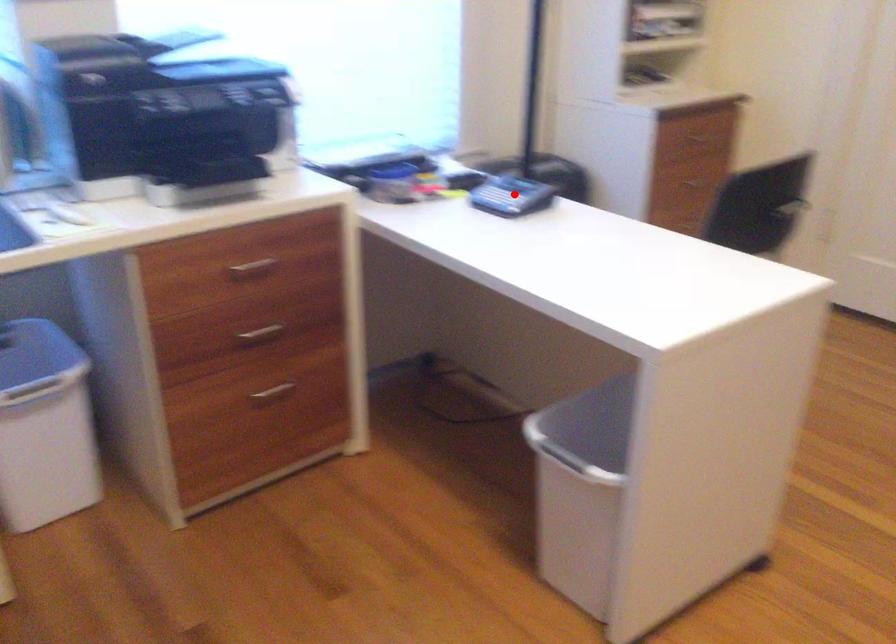
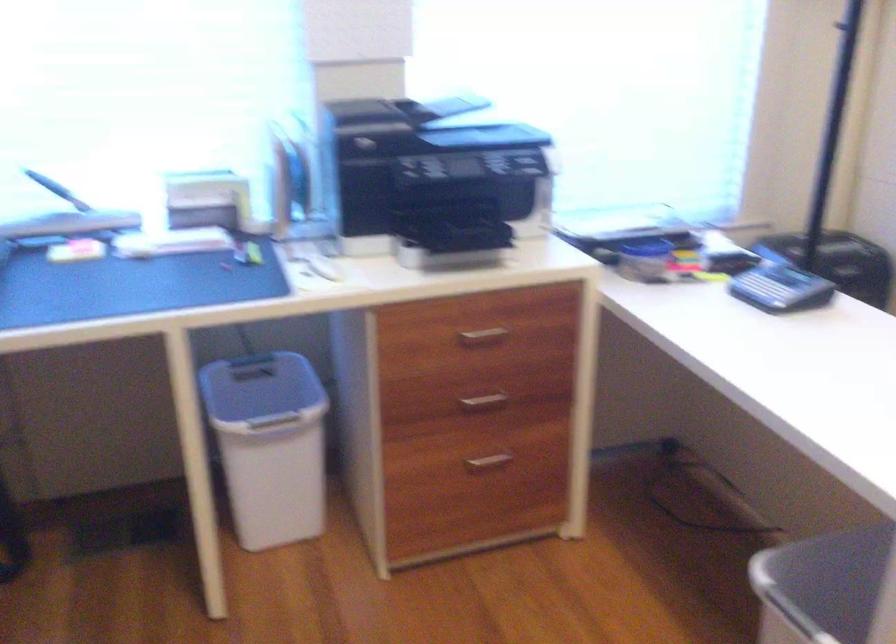
Where in the second image is the point corresponding to the highlighted location from the first image?

(780, 288)